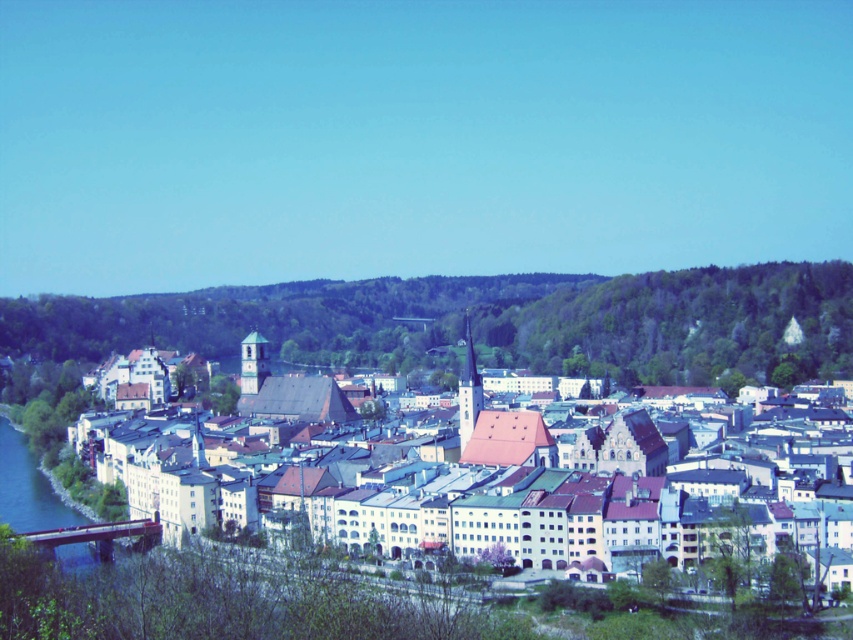
Question: Among these objects, which one is nearest to the camera?

Choices:
 (A) green leafy hillside at center
 (B) matte stone buildings at center

Answer: (B)

Question: Is green leafy hillside at center thinner than matte stone buildings at center?

Choices:
 (A) no
 (B) yes

Answer: (A)

Question: Does green leafy hillside at center appear on the left side of matte stone buildings at center?

Choices:
 (A) yes
 (B) no

Answer: (A)

Question: Is green leafy hillside at center thinner than matte stone buildings at center?

Choices:
 (A) yes
 (B) no

Answer: (B)

Question: Which point is farther to the camera?

Choices:
 (A) (842, 289)
 (B) (268, 410)

Answer: (A)